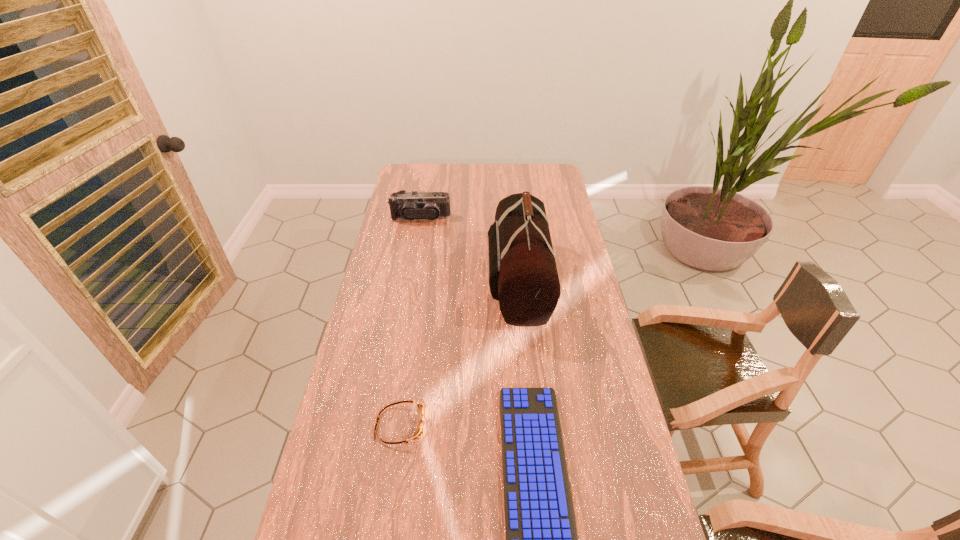
Select which object appears as the third closest to the second farthest object. Please provide its 2D coordinates. Your answer should be formatted as a tuple, i.e. [(x, y)], where the tuple contains the x and y coordinates of a point satisfying the conditions above.

[(420, 431)]

Locate which object is the second closest to the goggles. Please provide its 2D coordinates. Your answer should be formatted as a tuple, i.e. [(x, y)], where the tuple contains the x and y coordinates of a point satisfying the conditions above.

[(523, 277)]